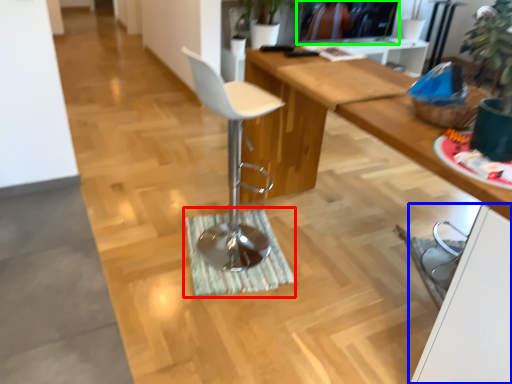
Question: Estimate the real-world distances between objects in this image. Which object is closer to doormat (highlighted by a red box), cabinetry (highlighted by a blue box) or television (highlighted by a green box)?

Choices:
 (A) cabinetry
 (B) television

Answer: (A)